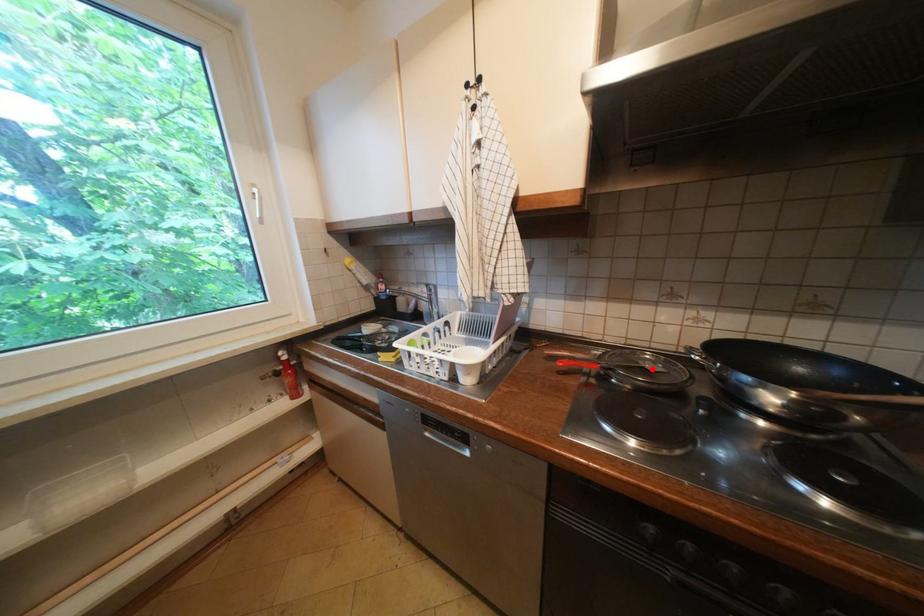
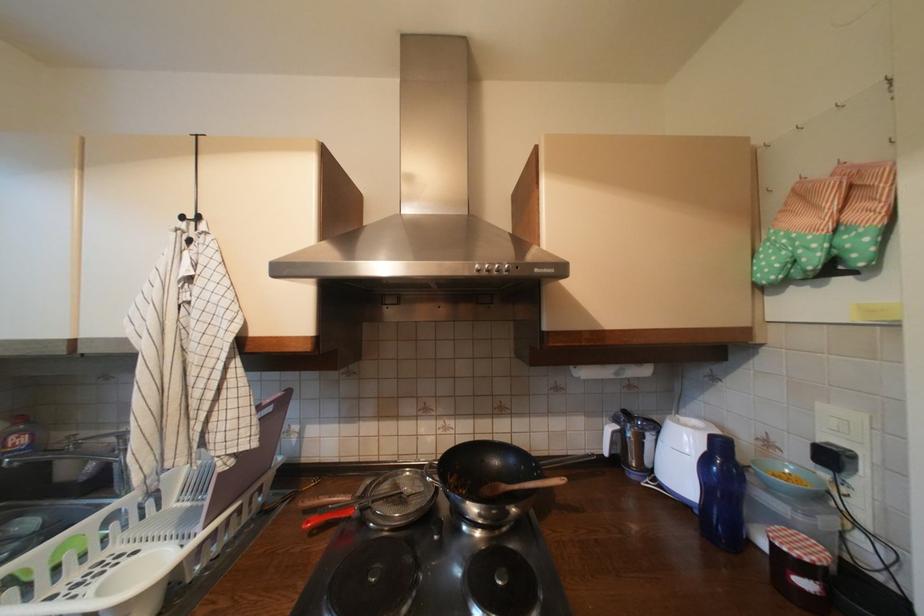
Question: I am providing you with two images of the same scene from different viewpoints. A red point is marked on the first image. At the location where the point appears in image 1, is it still visible in image 2?

Choices:
 (A) Yes
 (B) No

Answer: (A)